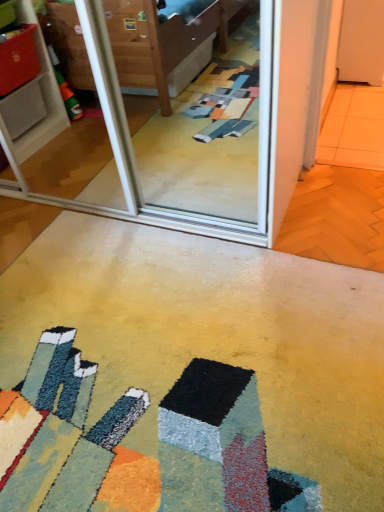
Question: From the image's perspective, relative to transparent glass screen door at upper center, is carpeted floor at center above or below?

Choices:
 (A) below
 (B) above

Answer: (A)

Question: Considering their positions, is carpeted floor at center located in front of or behind transparent glass screen door at upper center?

Choices:
 (A) front
 (B) behind

Answer: (A)

Question: Would you say carpeted floor at center is to the left or to the right of transparent glass screen door at upper center in the picture?

Choices:
 (A) left
 (B) right

Answer: (B)

Question: In terms of width, does transparent glass screen door at upper center look wider or thinner when compared to carpeted floor at center?

Choices:
 (A) thin
 (B) wide

Answer: (A)

Question: From their relative heights in the image, would you say transparent glass screen door at upper center is taller or shorter than carpeted floor at center?

Choices:
 (A) tall
 (B) short

Answer: (A)

Question: In the image, is transparent glass screen door at upper center positioned in front of or behind carpeted floor at center?

Choices:
 (A) behind
 (B) front

Answer: (A)

Question: From a real-world perspective, is transparent glass screen door at upper center positioned above or below carpeted floor at center?

Choices:
 (A) below
 (B) above

Answer: (B)